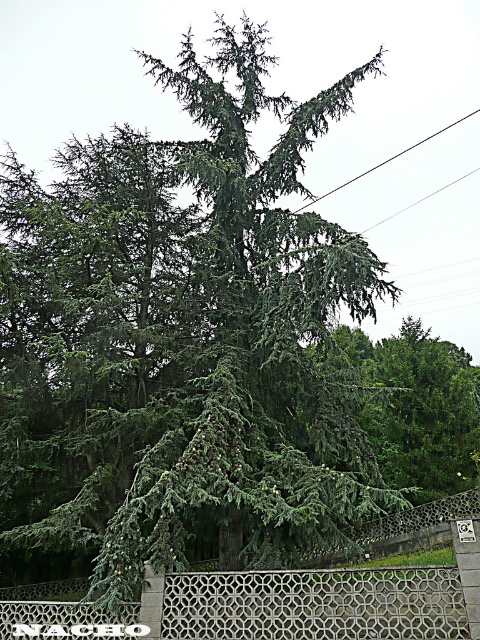
Can you confirm if white textured fence at lower center is positioned to the left of black wire at upper center?

Correct, you'll find white textured fence at lower center to the left of black wire at upper center.

Who is more distant from viewer, [226,616] or [409,147]?

The point [409,147] is behind.

This screenshot has width=480, height=640. What do you see at coordinates (315, 604) in the screenshot? I see `white textured fence at lower center` at bounding box center [315, 604].

At what (x,y) coordinates should I click in order to perform the action: click on white textured fence at lower center. Please return your answer as a coordinate pair (x, y). This screenshot has height=640, width=480. Looking at the image, I should click on (315, 604).